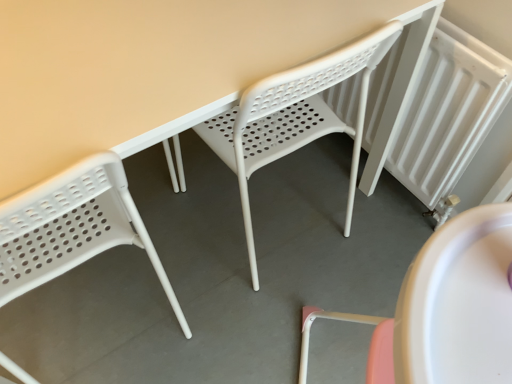
Question: Considering the relative sizes of white plastic chair at center, which appears as the 1th chair when viewed from the right, and white plastic chair at left, arranged as the 1th chair when viewed from the left, in the image provided, is white plastic chair at center, which appears as the 1th chair when viewed from the right, taller than white plastic chair at left, arranged as the 1th chair when viewed from the left,?

Choices:
 (A) no
 (B) yes

Answer: (B)

Question: Is white plastic chair at center, which is counted as the second chair, starting from the left, smaller than white plastic chair at left, which is counted as the 2th chair, starting from the right?

Choices:
 (A) yes
 (B) no

Answer: (B)

Question: Can you confirm if white plastic chair at center, which appears as the 1th chair when viewed from the right, is thinner than white plastic chair at left, arranged as the 1th chair when viewed from the left?

Choices:
 (A) yes
 (B) no

Answer: (B)

Question: From a real-world perspective, does white plastic chair at center, which is counted as the second chair, starting from the left, sit lower than white plastic chair at left, arranged as the 1th chair when viewed from the left?

Choices:
 (A) yes
 (B) no

Answer: (A)

Question: From the image's perspective, does white plastic chair at center, which appears as the 1th chair when viewed from the right, appear lower than white plastic chair at left, arranged as the 1th chair when viewed from the left?

Choices:
 (A) no
 (B) yes

Answer: (A)

Question: Considering the positions of white textured radiator at right and white plastic chair at center, which appears as the 1th chair when viewed from the right, in the image, is white textured radiator at right bigger or smaller than white plastic chair at center, which appears as the 1th chair when viewed from the right,?

Choices:
 (A) big
 (B) small

Answer: (B)

Question: From the image's perspective, is white textured radiator at right located above or below white plastic chair at center, which appears as the 1th chair when viewed from the right?

Choices:
 (A) below
 (B) above

Answer: (B)

Question: Choose the correct answer: Is white textured radiator at right inside white plastic chair at center, which is counted as the second chair, starting from the left, or outside it?

Choices:
 (A) outside
 (B) inside

Answer: (A)

Question: From a real-world perspective, is white textured radiator at right physically located above or below white plastic chair at center, which is counted as the second chair, starting from the left?

Choices:
 (A) below
 (B) above

Answer: (A)

Question: From a real-world perspective, is white plastic chair at left, which is counted as the 2th chair, starting from the right, above or below white textured radiator at right?

Choices:
 (A) above
 (B) below

Answer: (A)

Question: Is point (101, 241) closer or farther from the camera than point (465, 152)?

Choices:
 (A) closer
 (B) farther

Answer: (A)

Question: Is white plastic chair at left, which is counted as the 2th chair, starting from the right, taller or shorter than white textured radiator at right?

Choices:
 (A) short
 (B) tall

Answer: (B)

Question: From the image's perspective, is white plastic chair at left, which is counted as the 2th chair, starting from the right, above or below white textured radiator at right?

Choices:
 (A) above
 (B) below

Answer: (B)

Question: From the image's perspective, relative to white plastic chair at left, arranged as the 1th chair when viewed from the left, is white plastic chair at center, which appears as the 1th chair when viewed from the right, above or below?

Choices:
 (A) above
 (B) below

Answer: (A)

Question: Is point coord(271,127) closer or farther from the camera than point coord(105,236)?

Choices:
 (A) closer
 (B) farther

Answer: (B)